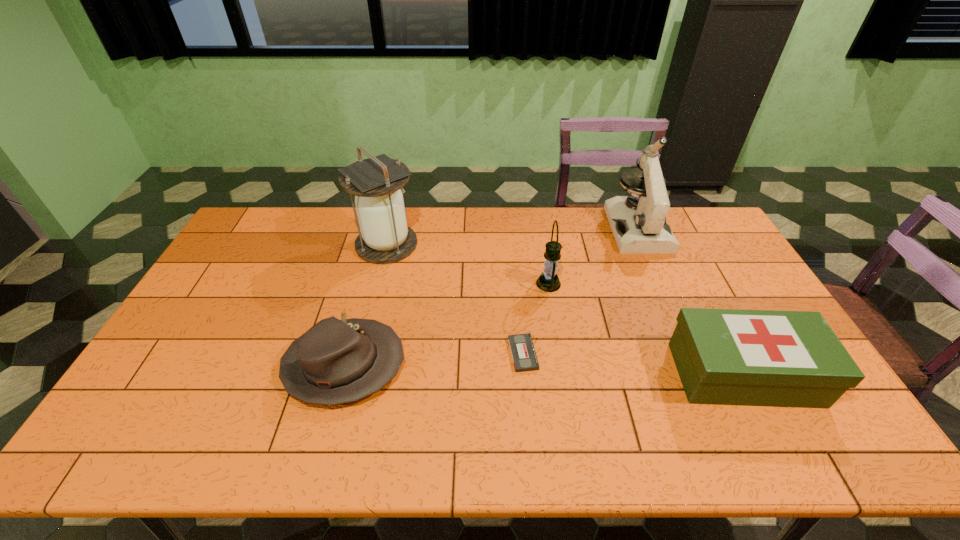
Where is `vacant area that lies between the microscope and the taller lantern`? The image size is (960, 540). vacant area that lies between the microscope and the taller lantern is located at coordinates (512, 236).

The image size is (960, 540). I want to click on free space between the hat and the microscope, so click(x=491, y=296).

Where is `free space that is in between the microscope and the first-aid kit`? The height and width of the screenshot is (540, 960). free space that is in between the microscope and the first-aid kit is located at coordinates (690, 301).

Identify the location of free space between the third shortest object and the hat. The height and width of the screenshot is (540, 960). (544, 370).

Where is `the fourth closest object relative to the fourth object from right to left`? the fourth closest object relative to the fourth object from right to left is located at coordinates (385, 238).

Find the location of a particular element. Image resolution: width=960 pixels, height=540 pixels. the third closest object relative to the fifth tallest object is located at coordinates (548, 281).

This screenshot has width=960, height=540. What are the coordinates of `vacant area that satisfies the following two spatial constraints: 1. on the decorative side of the third shortest object; 2. on the right side of the hat` in the screenshot? It's located at (342, 374).

Find the location of a particular element. vacant space that satisfies the following two spatial constraints: 1. on the decorative side of the first-aid kit; 2. on the left side of the second shortest object is located at coordinates (342, 374).

Where is `free location that satisfies the following two spatial constraints: 1. on the front side of the first-aid kit; 2. on the right side of the fourth object from right to left`? The image size is (960, 540). free location that satisfies the following two spatial constraints: 1. on the front side of the first-aid kit; 2. on the right side of the fourth object from right to left is located at coordinates (525, 374).

Identify the location of free space that satisfies the following two spatial constraints: 1. on the front side of the taller lantern; 2. on the right side of the first-aid kit. (354, 374).